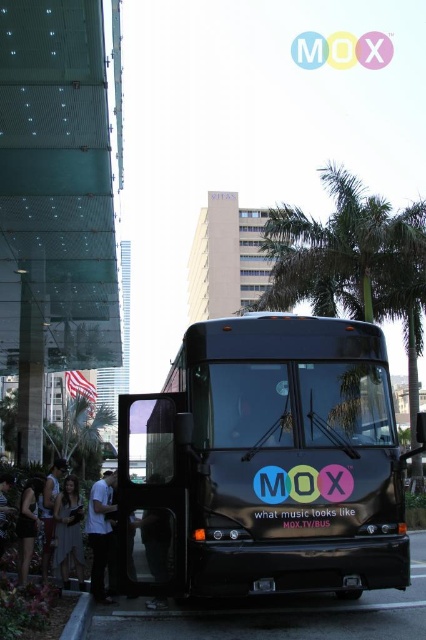
Question: Is black leather jacket at lower left to the right of camouflage fabric shirt at lower left from the viewer's perspective?

Choices:
 (A) yes
 (B) no

Answer: (A)

Question: Which of these objects is positioned farthest from the white cotton shirt at center?

Choices:
 (A) camouflage fabric shirt at lower left
 (B) gray concrete curb at lower left

Answer: (A)

Question: Can you confirm if matte gray dress at lower left is smaller than camouflage fabric shirt at lower left?

Choices:
 (A) no
 (B) yes

Answer: (A)

Question: Which of the following is the closest to the observer?

Choices:
 (A) pyautogui.click(x=40, y=500)
 (B) pyautogui.click(x=347, y=522)
 (C) pyautogui.click(x=22, y=525)
 (D) pyautogui.click(x=359, y=317)

Answer: (B)

Question: Considering the relative positions of green leafy palm tree at center and black leather jacket at lower left in the image provided, where is green leafy palm tree at center located with respect to black leather jacket at lower left?

Choices:
 (A) right
 (B) left

Answer: (A)

Question: Which object is closer to the camera taking this photo?

Choices:
 (A) white cotton shirt at center
 (B) matte gray dress at lower left

Answer: (A)